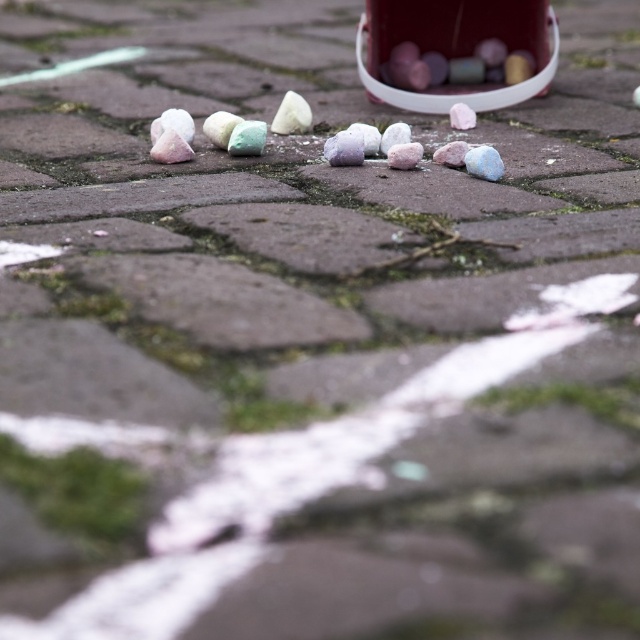
Between white matte rock at center and white matte cotton candy at center, which one appears on the right side from the viewer's perspective?

white matte cotton candy at center

Is white matte rock at center bigger than white matte cotton candy at center?

Yes.

Does point (301, 97) lie behind point (456, 106)?

That is True.

At what (x,y) coordinates should I click in order to perform the action: click on white matte rock at center. Please return your answer as a coordinate pair (x, y). This screenshot has height=640, width=640. Looking at the image, I should click on (291, 115).

From the picture: Does glossy plastic cotton candy at upper right have a greater height compared to white matte cotton candy at center?

Yes.

Does glossy plastic cotton candy at upper right have a smaller size compared to white matte cotton candy at center?

Actually, glossy plastic cotton candy at upper right might be larger than white matte cotton candy at center.

Where is `glossy plastic cotton candy at upper right`? glossy plastic cotton candy at upper right is located at coordinates (452, 67).

Does glossy plastic cotton candy at upper right have a lesser height compared to white matte rock at center?

No, glossy plastic cotton candy at upper right is not shorter than white matte rock at center.

Image resolution: width=640 pixels, height=640 pixels. What do you see at coordinates (452, 67) in the screenshot? I see `glossy plastic cotton candy at upper right` at bounding box center [452, 67].

Who is more distant from viewer, (396, 60) or (292, 115)?

Positioned behind is point (396, 60).

This screenshot has height=640, width=640. Find the location of `glossy plastic cotton candy at upper right`. glossy plastic cotton candy at upper right is located at coordinates click(x=452, y=67).